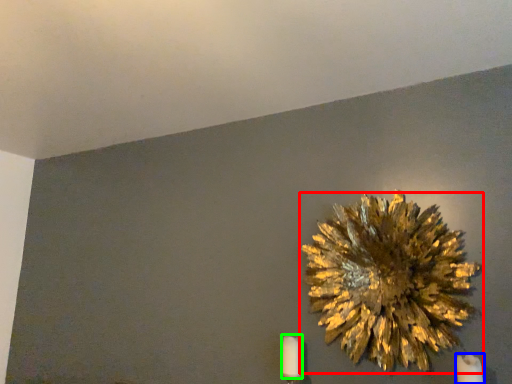
Question: Estimate the real-world distances between objects in this image. Which object is farther from flower (highlighted by a red box), candle (highlighted by a blue box) or candle (highlighted by a green box)?

Choices:
 (A) candle
 (B) candle

Answer: (B)